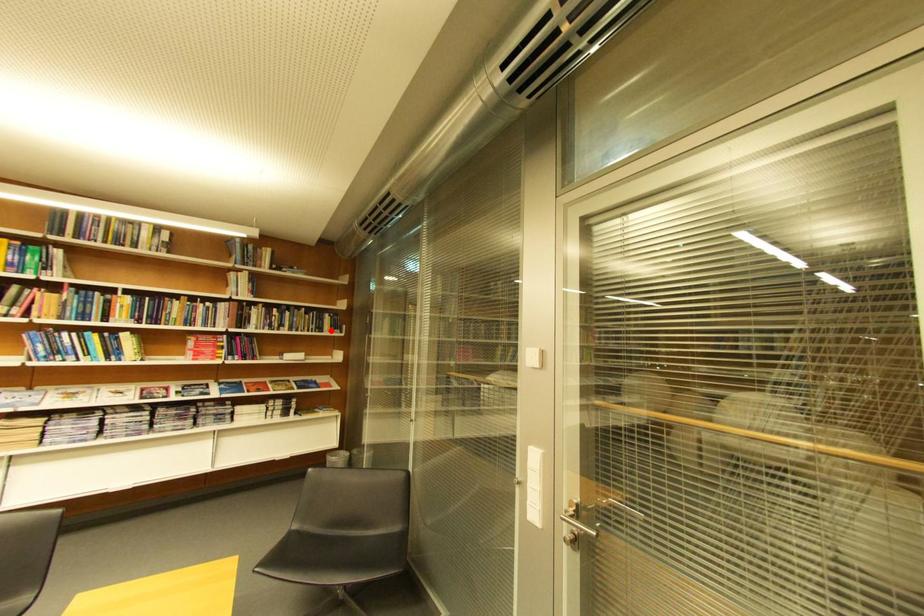
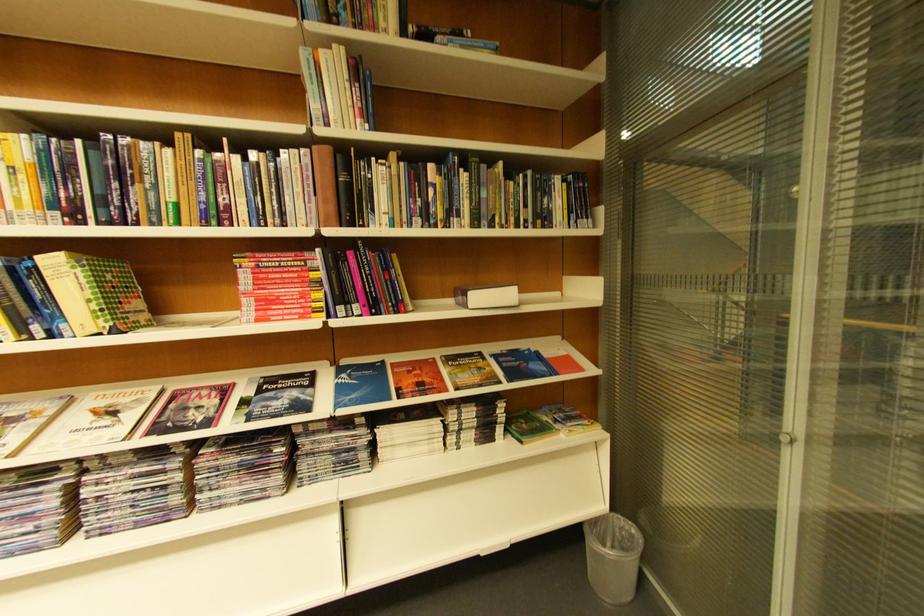
Question: I am providing you with two images of the same scene from different viewpoints. A red point is marked on the first image. Is the red point's position out of view in image 2?

Choices:
 (A) Yes
 (B) No

Answer: (B)